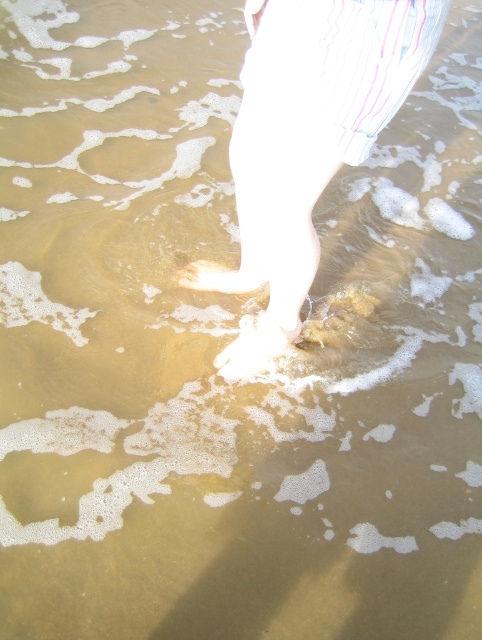
Does white matte sand at center have a lesser height compared to white matte foot at center?

No, white matte sand at center is not shorter than white matte foot at center.

Who is higher up, white matte sand at center or white matte foot at center?

Positioned higher is white matte foot at center.

Does point (239, 365) come behind point (183, 269)?

No, (239, 365) is closer to viewer.

Identify the location of white matte sand at center. (254, 346).

Is the position of white cotton leg at center more distant than that of white matte sand at center?

No.

Is white cotton leg at center to the left of white matte sand at center from the viewer's perspective?

In fact, white cotton leg at center is to the right of white matte sand at center.

Between point (327, 65) and point (251, 348), which one is positioned behind?

Point (251, 348)

Locate an element on the screen. Image resolution: width=482 pixels, height=640 pixels. white cotton leg at center is located at coordinates (311, 129).

Can you confirm if white cotton leg at center is smaller than white matte foot at center?

Incorrect, white cotton leg at center is not smaller in size than white matte foot at center.

Can you confirm if white cotton leg at center is shorter than white matte foot at center?

In fact, white cotton leg at center may be taller than white matte foot at center.

This screenshot has width=482, height=640. I want to click on white cotton leg at center, so click(311, 129).

Locate an element on the screen. The image size is (482, 640). white cotton leg at center is located at coordinates (311, 129).